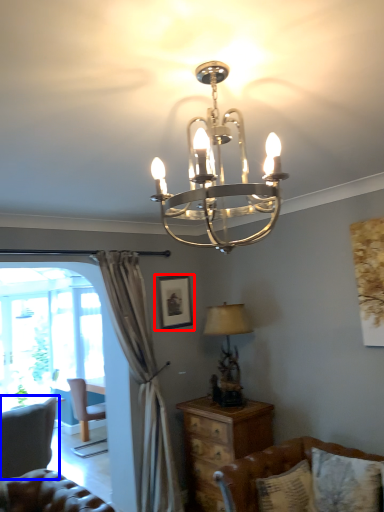
Question: Which point is further to the camera, picture frame (highlighted by a red box) or swivel chair (highlighted by a blue box)?

Choices:
 (A) picture frame
 (B) swivel chair

Answer: (A)